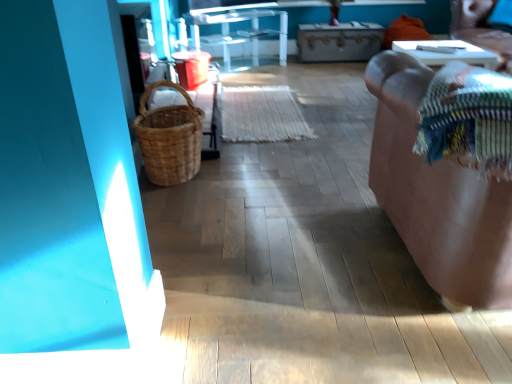
What do you see at coordinates (239, 31) in the screenshot? The image size is (512, 384). I see `transparent glass table at center, which is the 2th furniture in right-to-left order` at bounding box center [239, 31].

The height and width of the screenshot is (384, 512). What do you see at coordinates (468, 119) in the screenshot?
I see `multicolored woven blanket at right` at bounding box center [468, 119].

In order to click on wooden drawer at center in this screenshot , I will do `click(339, 42)`.

What is the approximate width of wooden drawer at center?

wooden drawer at center is 51.38 centimeters wide.

Image resolution: width=512 pixels, height=384 pixels. What are the coordinates of `transparent glass table at center, which is the 2th furniture in right-to-left order` in the screenshot? It's located at (239, 31).

Is wooden drawer at center positioned with its back to brown leather couch at right, the 1th furniture in the bottom-to-top sequence?

No.

Between wooden drawer at center and brown leather couch at right, the 2th furniture when ordered from back to front, which one has more height?

brown leather couch at right, the 2th furniture when ordered from back to front.

From the picture: From a real-world perspective, is wooden drawer at center beneath brown leather couch at right, the 1th furniture in the bottom-to-top sequence?

Yes, from a real-world perspective, wooden drawer at center is beneath brown leather couch at right, the 1th furniture in the bottom-to-top sequence.

Is wooden drawer at center wider than brown leather couch at right, the 2th furniture when ordered from back to front?

Incorrect, the width of wooden drawer at center does not surpass that of brown leather couch at right, the 2th furniture when ordered from back to front.

Can you tell me how much wooden drawer at center and transparent glass table at center, the first furniture viewed from the left, differ in facing direction?

There is a 41.1-degree angle between the facing directions of wooden drawer at center and transparent glass table at center, the first furniture viewed from the left.

Between wooden drawer at center and transparent glass table at center, the 2th furniture in the front-to-back sequence, which one has more height?

Standing taller between the two is transparent glass table at center, the 2th furniture in the front-to-back sequence.

Is wooden drawer at center next to transparent glass table at center, the 1th furniture positioned from the top?

No.

Is wooden drawer at center inside the boundaries of transparent glass table at center, the first furniture viewed from the left, or outside?

wooden drawer at center is outside transparent glass table at center, the first furniture viewed from the left.

Between multicolored woven blanket at right and brown leather couch at right, the second furniture viewed from the top, which one is positioned in front?

multicolored woven blanket at right.

Is multicolored woven blanket at right directly adjacent to brown leather couch at right, the 1th furniture in the front-to-back sequence?

They are not placed beside each other.

Is multicolored woven blanket at right oriented towards brown leather couch at right, placed as the first furniture when sorted from right to left?

Yes, multicolored woven blanket at right is facing brown leather couch at right, placed as the first furniture when sorted from right to left.

How distant is brown woven basket at upper right from multicolored woven blanket at right?

A distance of 2.54 meters exists between brown woven basket at upper right and multicolored woven blanket at right.

Considering the relative positions of brown woven basket at upper right and multicolored woven blanket at right in the image provided, is brown woven basket at upper right to the left of multicolored woven blanket at right from the viewer's perspective?

No.

From a real-world perspective, is brown woven basket at upper right beneath multicolored woven blanket at right?

Yes, from a real-world perspective, brown woven basket at upper right is under multicolored woven blanket at right.

Is brown woven basket at upper right positioned before multicolored woven blanket at right?

No, the depth of brown woven basket at upper right is greater than that of multicolored woven blanket at right.

Does multicolored woven blanket at right have a lesser width compared to brown woven basket at upper right?

No.

Is there a large distance between multicolored woven blanket at right and brown woven basket at upper right?

Yes.

Is multicolored woven blanket at right bigger than brown woven basket at upper right?

Incorrect, multicolored woven blanket at right is not larger than brown woven basket at upper right.

From a real-world perspective, between multicolored woven blanket at right and brown woven basket at upper right, who is vertically higher?

multicolored woven blanket at right, from a real-world perspective.

Considering the positions of objects transparent glass table at center, the 2th furniture when ordered from bottom to top, and multicolored woven blanket at right in the image provided, who is more to the left, transparent glass table at center, the 2th furniture when ordered from bottom to top, or multicolored woven blanket at right?

From the viewer's perspective, transparent glass table at center, the 2th furniture when ordered from bottom to top, appears more on the left side.

Is transparent glass table at center, the 1th furniture positioned from the top, next to multicolored woven blanket at right?

No, transparent glass table at center, the 1th furniture positioned from the top, is not in contact with multicolored woven blanket at right.

Does transparent glass table at center, which is the 2th furniture in right-to-left order, turn towards multicolored woven blanket at right?

Yes, transparent glass table at center, which is the 2th furniture in right-to-left order, faces towards multicolored woven blanket at right.

Is transparent glass table at center, the 2th furniture in the front-to-back sequence, thinner than multicolored woven blanket at right?

Yes.

Could you measure the distance between transparent glass table at center, which is the first furniture from back to front, and brown leather couch at right, the 2th furniture when ordered from back to front?

transparent glass table at center, which is the first furniture from back to front, and brown leather couch at right, the 2th furniture when ordered from back to front, are 2.97 meters apart from each other.

The image size is (512, 384). Identify the location of furniture above the brown leather couch at right, placed as the first furniture when sorted from right to left (from the image's perspective). (239, 31).

Considering the relative sizes of transparent glass table at center, which is the 2th furniture in right-to-left order, and brown leather couch at right, the 1th furniture in the bottom-to-top sequence, in the image provided, is transparent glass table at center, which is the 2th furniture in right-to-left order, taller than brown leather couch at right, the 1th furniture in the bottom-to-top sequence,?

In fact, transparent glass table at center, which is the 2th furniture in right-to-left order, may be shorter than brown leather couch at right, the 1th furniture in the bottom-to-top sequence.

Which object is thinner, transparent glass table at center, the 2th furniture when ordered from bottom to top, or brown leather couch at right, placed as the first furniture when sorted from right to left?

Thinner between the two is transparent glass table at center, the 2th furniture when ordered from bottom to top.

Where is `furniture on the right of wooden drawer at center`? This screenshot has width=512, height=384. furniture on the right of wooden drawer at center is located at coordinates (437, 196).

Image resolution: width=512 pixels, height=384 pixels. There is a wooden drawer at center. Find the location of `the 1st furniture below it (from the image's perspective)`. the 1st furniture below it (from the image's perspective) is located at coordinates (239, 31).

From the picture: Estimate the real-world distances between objects in this image. Which object is closer to brown woven basket at upper right, wooden drawer at center or multicolored woven blanket at right?

The object closer to brown woven basket at upper right is wooden drawer at center.

Considering their positions, is wooden drawer at center positioned closer to transparent glass table at center, which is the first furniture from back to front, than brown leather couch at right, the second furniture viewed from the top?

Among the two, wooden drawer at center is located nearer to transparent glass table at center, which is the first furniture from back to front.

Considering their positions, is brown leather couch at right, the 2th furniture when ordered from back to front, positioned closer to multicolored woven blanket at right than transparent glass table at center, the 2th furniture when ordered from bottom to top?

brown leather couch at right, the 2th furniture when ordered from back to front, is positioned closer to the anchor multicolored woven blanket at right.

Based on their spatial positions, is brown leather couch at right, which ranks as the second furniture in left-to-right order, or brown woven basket at upper right further from multicolored woven blanket at right?

brown woven basket at upper right is further to multicolored woven blanket at right.

Estimate the real-world distances between objects in this image. Which object is closer to multicolored woven blanket at right, brown woven basket at upper right or transparent glass table at center, the 1th furniture positioned from the top?

Among the two, brown woven basket at upper right is located nearer to multicolored woven blanket at right.

From the image, which object appears to be farther from transparent glass table at center, the first furniture viewed from the left, brown leather couch at right, the 2th furniture when ordered from back to front, or multicolored woven blanket at right?

The object further to transparent glass table at center, the first furniture viewed from the left, is multicolored woven blanket at right.

Looking at this image, based on their spatial positions, is wooden drawer at center or brown woven basket at upper right further from brown leather couch at right, the 1th furniture in the bottom-to-top sequence?

The object further to brown leather couch at right, the 1th furniture in the bottom-to-top sequence, is wooden drawer at center.

Which object lies nearer to the anchor point multicolored woven blanket at right, transparent glass table at center, the 1th furniture positioned from the top, or brown leather couch at right, the 2th furniture when ordered from back to front?

Among the two, brown leather couch at right, the 2th furniture when ordered from back to front, is located nearer to multicolored woven blanket at right.

The image size is (512, 384). Identify the location of chair between multicolored woven blanket at right and wooden drawer at center from front to back. (481, 30).

Identify the location of chair between brown leather couch at right, placed as the first furniture when sorted from right to left, and transparent glass table at center, the 1th furniture positioned from the top, from front to back. (481, 30).

Where is `furniture between multicolored woven blanket at right and transparent glass table at center, the 2th furniture in the front-to-back sequence, in the front-back direction`? furniture between multicolored woven blanket at right and transparent glass table at center, the 2th furniture in the front-to-back sequence, in the front-back direction is located at coordinates (437, 196).

Find the location of a particular element. Image resolution: width=512 pixels, height=384 pixels. chair located between multicolored woven blanket at right and transparent glass table at center, the 1th furniture positioned from the top, in the depth direction is located at coordinates (481, 30).